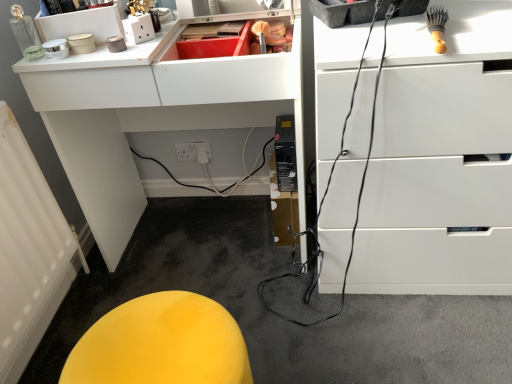
Question: Would you say white glossy chest of drawers at upper right is inside or outside white glossy computer desk at upper center?

Choices:
 (A) outside
 (B) inside

Answer: (A)

Question: Is white glossy chest of drawers at upper right taller or shorter than white glossy computer desk at upper center?

Choices:
 (A) short
 (B) tall

Answer: (A)

Question: Based on their relative distances, which object is nearer to the white textured radiator at lower left?

Choices:
 (A) white glossy computer desk at upper center
 (B) wooden-handled brush at upper right
 (C) white glossy chest of drawers at upper right
 (D) yellow fabric stool at lower left

Answer: (A)

Question: Considering the real-world distances, which object is closest to the white glossy computer desk at upper center?

Choices:
 (A) white textured radiator at lower left
 (B) white glossy chest of drawers at upper right
 (C) yellow fabric stool at lower left
 (D) wooden-handled brush at upper right

Answer: (A)